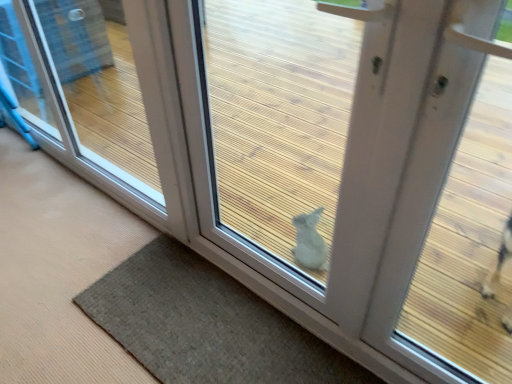
Question: From the image's perspective, is white matte door at center above transparent glass door at lower right?

Choices:
 (A) no
 (B) yes

Answer: (A)

Question: Is white matte door at center located outside transparent glass door at lower right?

Choices:
 (A) yes
 (B) no

Answer: (A)

Question: Can you confirm if white matte door at center is taller than transparent glass door at lower right?

Choices:
 (A) no
 (B) yes

Answer: (B)

Question: From the image's perspective, would you say white matte door at center is shown under transparent glass door at lower right?

Choices:
 (A) no
 (B) yes

Answer: (B)

Question: Does white matte door at center have a greater width compared to transparent glass door at lower right?

Choices:
 (A) yes
 (B) no

Answer: (B)

Question: Is white matte door at center to the left or to the right of brown textured mat at lower center in the image?

Choices:
 (A) right
 (B) left

Answer: (A)

Question: In terms of size, does white matte door at center appear bigger or smaller than brown textured mat at lower center?

Choices:
 (A) big
 (B) small

Answer: (A)

Question: Is white matte door at center spatially inside brown textured mat at lower center, or outside of it?

Choices:
 (A) outside
 (B) inside

Answer: (A)

Question: From the image's perspective, is white matte door at center located above or below brown textured mat at lower center?

Choices:
 (A) below
 (B) above

Answer: (B)

Question: In terms of width, does transparent glass door at lower right look wider or thinner when compared to brown textured mat at lower center?

Choices:
 (A) thin
 (B) wide

Answer: (A)

Question: Relative to brown textured mat at lower center, is transparent glass door at lower right in front or behind?

Choices:
 (A) behind
 (B) front

Answer: (A)

Question: In terms of height, does transparent glass door at lower right look taller or shorter compared to brown textured mat at lower center?

Choices:
 (A) tall
 (B) short

Answer: (A)

Question: Do you think transparent glass door at lower right is within brown textured mat at lower center, or outside of it?

Choices:
 (A) outside
 (B) inside

Answer: (A)

Question: In terms of size, does white matte door at center appear bigger or smaller than transparent glass door at lower right?

Choices:
 (A) big
 (B) small

Answer: (B)

Question: Is white matte door at center spatially inside transparent glass door at lower right, or outside of it?

Choices:
 (A) inside
 (B) outside

Answer: (B)